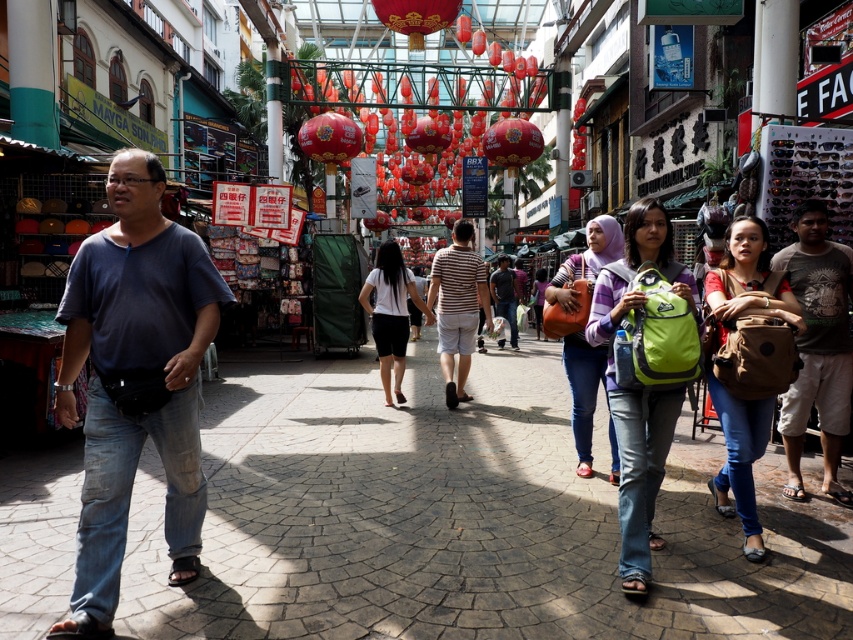
Question: Does paved stone at center come behind dark blue shirt at center?

Choices:
 (A) no
 (B) yes

Answer: (A)

Question: Which of the following is the closest to the observer?

Choices:
 (A) (438, 310)
 (B) (383, 332)

Answer: (A)

Question: Can you confirm if dark blue cotton shirt at left is positioned to the left of white matte skirt at center?

Choices:
 (A) yes
 (B) no

Answer: (A)

Question: Is dark blue cotton shirt at left above brown fabric backpack at right?

Choices:
 (A) no
 (B) yes

Answer: (A)

Question: Which point is closer to the camera taking this photo?

Choices:
 (A) (497, 298)
 (B) (93, 596)

Answer: (B)

Question: Which object is closer to the camera taking this photo?

Choices:
 (A) paved stone at center
 (B) white matte skirt at center

Answer: (A)